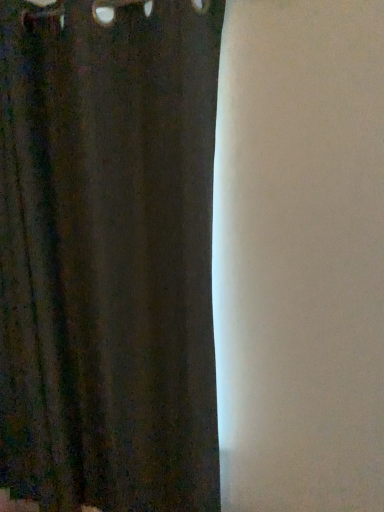
Find the location of `matte black curtain at left`. matte black curtain at left is located at coordinates (108, 256).

In order to face matte black curtain at left, should I rotate leftwards or rightwards?

It's best to rotate left around 15.998 degrees.

Describe the element at coordinates (108, 256) in the screenshot. The image size is (384, 512). I see `matte black curtain at left` at that location.

At what (x,y) coordinates should I click in order to perform the action: click on matte black curtain at left. Please return your answer as a coordinate pair (x, y). The height and width of the screenshot is (512, 384). Looking at the image, I should click on [x=108, y=256].